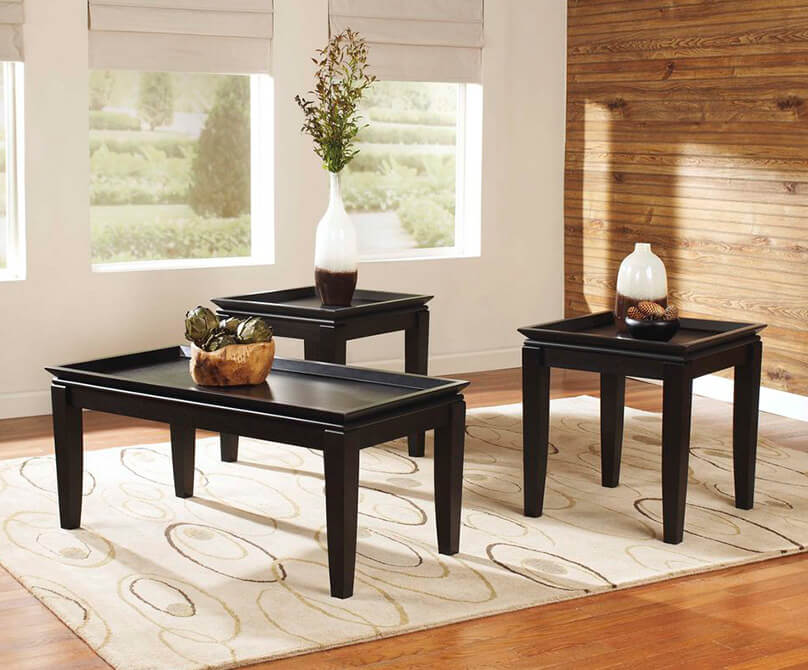
At what (x,y) coordinates should I click in order to perform the action: click on floor. Please return your answer as a coordinate pair (x, y). This screenshot has height=670, width=808. Looking at the image, I should click on (553, 628).